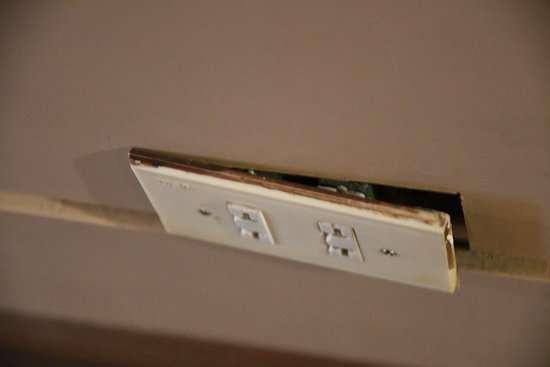
Identify the location of baseboard. (236, 300).